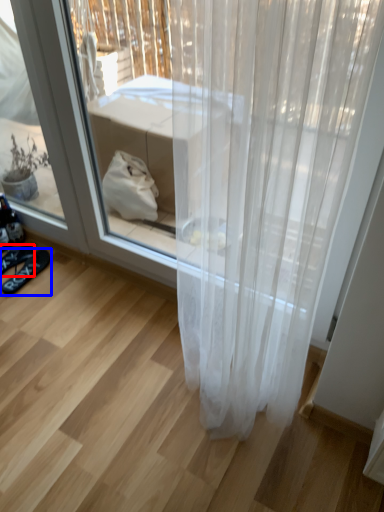
Question: Which point is further to the camera, footwear (highlighted by a red box) or footwear (highlighted by a blue box)?

Choices:
 (A) footwear
 (B) footwear

Answer: (A)